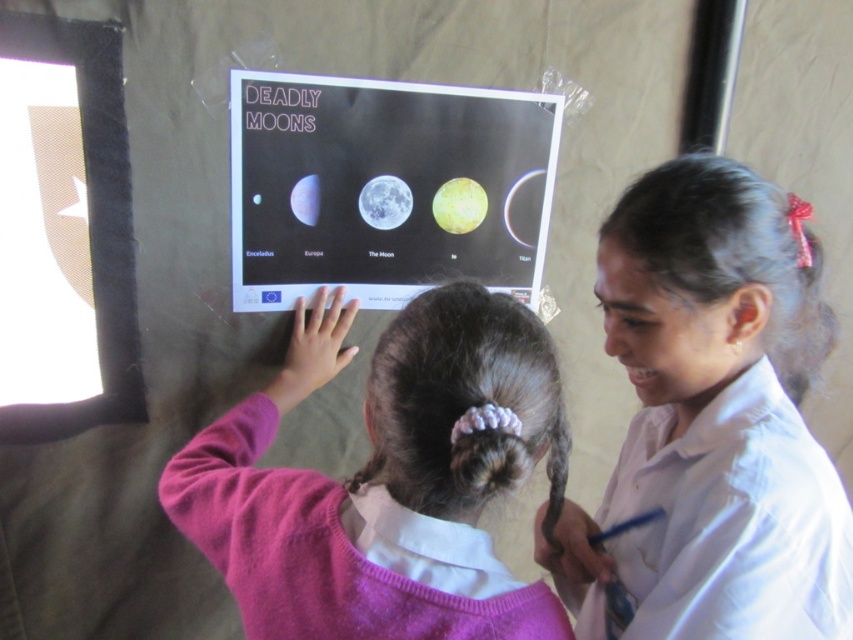
You are an observer standing in front of the poster titled DEADLY MOONS. You notice two people nearby. The person wearing the white shirt at upper right and the person in the pink sweater at upper center. Which of these two items of clothing is narrower in width?

The white shirt at upper right has a lesser width compared to the pink sweater at upper center, so the white shirt at upper right is narrower.